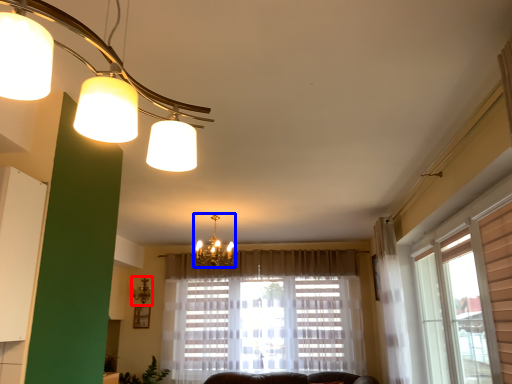
Question: Which point is closer to the camera, lamp (highlighted by a red box) or lamp (highlighted by a blue box)?

Choices:
 (A) lamp
 (B) lamp

Answer: (B)